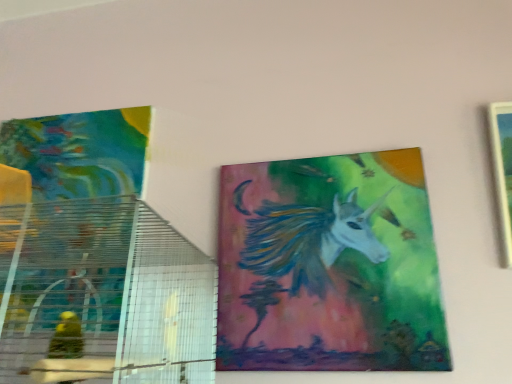
Question: Relative to wooden frame at right, which ranks as the first picture frame in right-to-left order, is painted unicorn at center, positioned as the second picture frame in right-to-left order, in front or behind?

Choices:
 (A) behind
 (B) front

Answer: (A)

Question: From a real-world perspective, is painted unicorn at center, the first picture frame when ordered from left to right, positioned above or below wooden frame at right, which ranks as the first picture frame in right-to-left order?

Choices:
 (A) above
 (B) below

Answer: (B)

Question: Does point (253, 231) appear closer or farther from the camera than point (490, 102)?

Choices:
 (A) farther
 (B) closer

Answer: (B)

Question: Considering the positions of wooden frame at right, which ranks as the first picture frame in right-to-left order, and painted unicorn at center, the first picture frame when ordered from left to right, in the image, is wooden frame at right, which ranks as the first picture frame in right-to-left order, wider or thinner than painted unicorn at center, the first picture frame when ordered from left to right,?

Choices:
 (A) thin
 (B) wide

Answer: (B)

Question: Is wooden frame at right, positioned as the second picture frame in left-to-right order, inside or outside of painted unicorn at center, the first picture frame when ordered from left to right?

Choices:
 (A) outside
 (B) inside

Answer: (A)

Question: In terms of height, does wooden frame at right, which ranks as the first picture frame in right-to-left order, look taller or shorter compared to painted unicorn at center, the first picture frame when ordered from left to right?

Choices:
 (A) short
 (B) tall

Answer: (A)

Question: Is point (508, 213) positioned closer to the camera than point (394, 352)?

Choices:
 (A) closer
 (B) farther

Answer: (B)